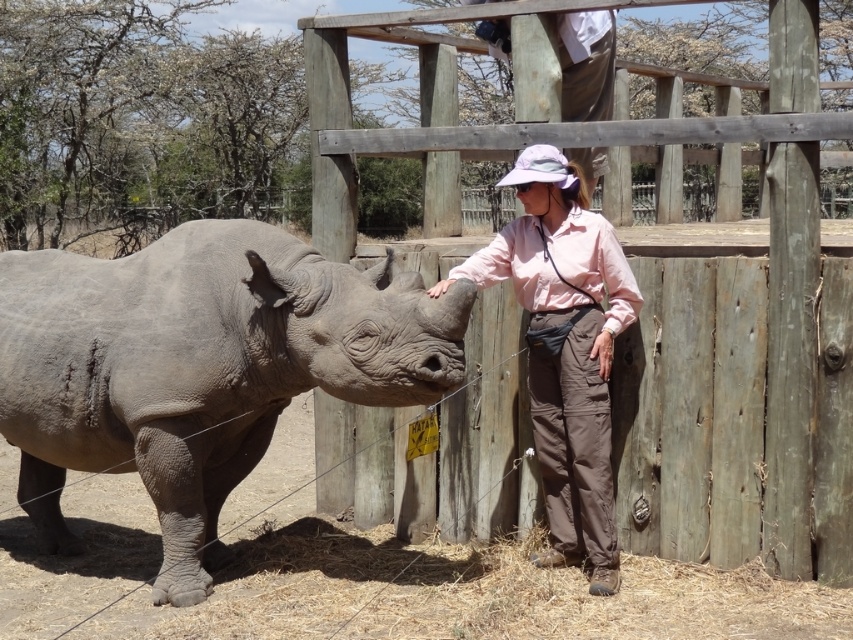
Question: Does gray matte rhinoceros at left appear on the left side of pink fabric shirt at center?

Choices:
 (A) no
 (B) yes

Answer: (B)

Question: Which object is closer to the camera taking this photo?

Choices:
 (A) light brown fabric pants at upper center
 (B) gray matte rhinoceros at left
 (C) pink fabric shirt at center

Answer: (B)

Question: In this image, where is gray matte rhinoceros at left located relative to light brown fabric pants at upper center?

Choices:
 (A) below
 (B) above

Answer: (A)

Question: Can you confirm if gray matte rhinoceros at left is positioned to the right of pink fabric shirt at center?

Choices:
 (A) no
 (B) yes

Answer: (A)

Question: Which point is closer to the camera taking this photo?

Choices:
 (A) (485, 33)
 (B) (230, 289)
 (C) (556, 275)

Answer: (B)

Question: Which object is the closest to the light brown fabric pants at upper center?

Choices:
 (A) gray matte rhinoceros at left
 (B) pink fabric shirt at center

Answer: (B)